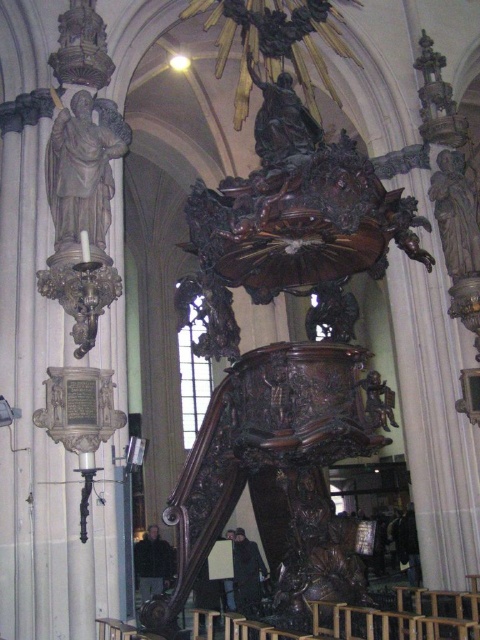
Does matte stone statue at left have a smaller size compared to brown polished wood statue at right?

Yes.

Is point (79, 204) in front of point (447, 152)?

Yes.

Find the location of `matte stone statue at left`. matte stone statue at left is located at coordinates (84, 168).

Looking at this image, can you confirm if brown polished wood statue at right is positioned above bronze statue at upper center?

Actually, brown polished wood statue at right is below bronze statue at upper center.

Which is more to the left, brown polished wood statue at right or bronze statue at upper center?

bronze statue at upper center is more to the left.

Is point (454, 204) in front of point (266, 164)?

No, it is not.

This screenshot has width=480, height=640. What are the coordinates of `brown polished wood statue at right` in the screenshot? It's located at (456, 212).

Is point (109, 209) closer to viewer compared to point (295, 125)?

That is True.

Is point (70, 202) behind point (273, 93)?

That is False.

Locate an element on the screen. matte stone statue at left is located at coordinates (84, 168).